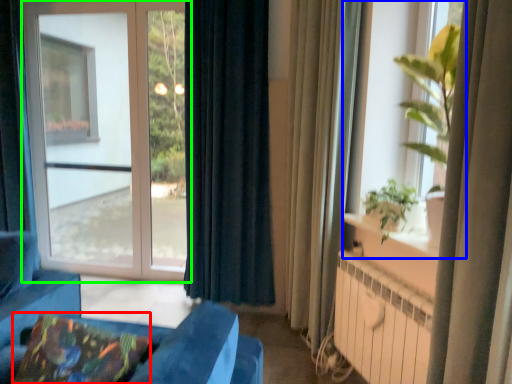
Question: Estimate the real-world distances between objects in this image. Which object is farther from pillow (highlighted by a red box), window (highlighted by a blue box) or window (highlighted by a green box)?

Choices:
 (A) window
 (B) window

Answer: (B)